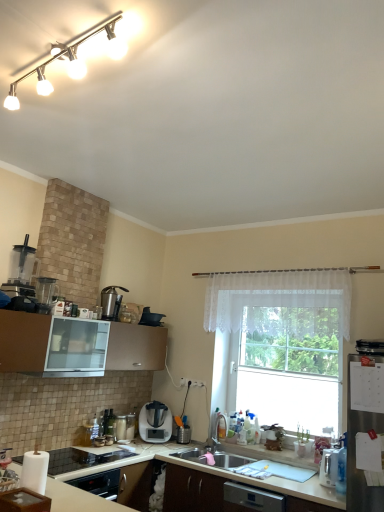
Image resolution: width=384 pixels, height=512 pixels. What do you see at coordinates (122, 426) in the screenshot?
I see `white glossy blender at lower center, marked as the third appliance in a left-to-right arrangement` at bounding box center [122, 426].

Describe the element at coordinates (333, 466) in the screenshot. I see `satin silver kettle at lower right, the 5th appliance in the back-to-front sequence` at that location.

Describe the element at coordinates (20, 273) in the screenshot. Image resolution: width=384 pixels, height=512 pixels. I see `transparent plastic blender at upper left, positioned as the second home appliance in back-to-front order` at that location.

Measure the distance between transparent plastic blender at upper left, the 1th home appliance from the top, and camera.

They are 9.76 feet apart.

Locate an element on the screen. The image size is (384, 512). metallic silver blender at left, placed as the 2th appliance when sorted from front to back is located at coordinates (45, 289).

Describe the element at coordinates (111, 302) in the screenshot. Image resolution: width=384 pixels, height=512 pixels. I see `metallic silver coffee maker at upper center` at that location.

In order to face matte black pot at upper center, marked as the 4th appliance in a bottom-to-top arrangement, should I rotate leftwards or rightwards?

A 5.035 degree turn to the left will do.

The width and height of the screenshot is (384, 512). I want to click on white glossy blender at lower center, placed as the fourth appliance when sorted from front to back, so click(x=122, y=426).

What's the angular difference between satin silver kettle at lower right, the 5th appliance in the back-to-front sequence, and white plastic electric outlet at center's facing directions?

satin silver kettle at lower right, the 5th appliance in the back-to-front sequence, and white plastic electric outlet at center are facing 177 degrees away from each other.

Would you say satin silver kettle at lower right, the 5th appliance in the back-to-front sequence, is inside or outside white plastic electric outlet at center?

satin silver kettle at lower right, the 5th appliance in the back-to-front sequence, is spatially situated outside white plastic electric outlet at center.

From the image's perspective, which is above, satin silver kettle at lower right, arranged as the 1th appliance when viewed from the front, or white plastic electric outlet at center?

From the image's view, white plastic electric outlet at center is above.

From the image's perspective, which one is positioned lower, white plastic electric outlet at center or metallic silver toaster at lower left, which is the third appliance in back-to-front order?

metallic silver toaster at lower left, which is the third appliance in back-to-front order, appears lower in the image.

Looking at this image, is white plastic electric outlet at center positioned with its back to metallic silver toaster at lower left, positioned as the 2th appliance in left-to-right order?

No, white plastic electric outlet at center is not facing the opposite direction of metallic silver toaster at lower left, positioned as the 2th appliance in left-to-right order.

From a real-world perspective, is white plastic electric outlet at center under metallic silver toaster at lower left, arranged as the fourth appliance when viewed from the right?

No.

Is white plastic electric outlet at center thinner than metallic silver toaster at lower left, arranged as the fourth appliance when viewed from the right?

Yes, white plastic electric outlet at center is thinner than metallic silver toaster at lower left, arranged as the fourth appliance when viewed from the right.

From a real-world perspective, between white sheer curtain at center and transparent plastic blender at upper left, which is the first home appliance from front to back, who is vertically higher?

From a 3D spatial view, white sheer curtain at center is above.

Is point (301, 287) farther from viewer compared to point (6, 287)?

Yes.

Would you say white sheer curtain at center is inside or outside transparent plastic blender at upper left, the 1th home appliance from the top?

white sheer curtain at center exists outside the volume of transparent plastic blender at upper left, the 1th home appliance from the top.

Is white sheer curtain at center far away from transparent plastic blender at upper left, positioned as the second home appliance in back-to-front order?

white sheer curtain at center is far away from transparent plastic blender at upper left, positioned as the second home appliance in back-to-front order.

Does white glossy track lights at upper left have a lesser width compared to white matte countertop at lower center, placed as the second countertop when sorted from top to bottom?

Indeed, white glossy track lights at upper left has a lesser width compared to white matte countertop at lower center, placed as the second countertop when sorted from top to bottom.

From a real-world perspective, is white glossy track lights at upper left physically below white matte countertop at lower center, placed as the second countertop when sorted from top to bottom?

No, from a real-world perspective, white glossy track lights at upper left is not under white matte countertop at lower center, placed as the second countertop when sorted from top to bottom.

From the image's perspective, which one is positioned lower, white glossy track lights at upper left or white matte countertop at lower center, placed as the second countertop when sorted from top to bottom?

From the image's view, white matte countertop at lower center, placed as the second countertop when sorted from top to bottom, is below.

Is white glossy track lights at upper left facing towards white matte countertop at lower center, placed as the second countertop when sorted from top to bottom?

No, white glossy track lights at upper left does not turn towards white matte countertop at lower center, placed as the second countertop when sorted from top to bottom.

Is point (119, 415) in front of point (42, 287)?

No, it is behind (42, 287).

Does white glossy blender at lower center, which appears as the fifth appliance when viewed from the top, have a greater height compared to metallic silver blender at left, which is counted as the first appliance, starting from the left?

In fact, white glossy blender at lower center, which appears as the fifth appliance when viewed from the top, may be shorter than metallic silver blender at left, which is counted as the first appliance, starting from the left.

Considering the sizes of objects white glossy blender at lower center, marked as the third appliance in a left-to-right arrangement, and metallic silver blender at left, arranged as the fifth appliance when viewed from the right, in the image provided, who is wider, white glossy blender at lower center, marked as the third appliance in a left-to-right arrangement, or metallic silver blender at left, arranged as the fifth appliance when viewed from the right,?

Wider between the two is white glossy blender at lower center, marked as the third appliance in a left-to-right arrangement.

How many degrees apart are the facing directions of white glossy blender at lower center, which appears as the 2th appliance when viewed from the back, and metallic silver blender at left, placed as the 2th appliance when sorted from front to back?

The angle between the facing direction of white glossy blender at lower center, which appears as the 2th appliance when viewed from the back, and the facing direction of metallic silver blender at left, placed as the 2th appliance when sorted from front to back, is 5.89 degrees.

Does white plastic electric outlet at center have a greater width compared to matte black pot at upper center, marked as the fifth appliance in a front-to-back arrangement?

No, white plastic electric outlet at center is not wider than matte black pot at upper center, marked as the fifth appliance in a front-to-back arrangement.

From the image's perspective, between white plastic electric outlet at center and matte black pot at upper center, positioned as the second appliance in right-to-left order, which one is located above?

From the image's view, matte black pot at upper center, positioned as the second appliance in right-to-left order, is above.

The height and width of the screenshot is (512, 384). I want to click on appliance that is the 1st one above the white plastic electric outlet at center (from a real-world perspective), so click(150, 318).

Is there a large distance between white plastic electric outlet at center and matte black pot at upper center, acting as the second appliance starting from the top?

They are positioned close to each other.

Does satin silver blender at center, which ranks as the second home appliance in front-to-back order, have a greater width compared to white plastic electric outlet at center?

Yes, satin silver blender at center, which ranks as the second home appliance in front-to-back order, is wider than white plastic electric outlet at center.

Who is smaller, satin silver blender at center, marked as the first home appliance in a back-to-front arrangement, or white plastic electric outlet at center?

Smaller between the two is white plastic electric outlet at center.

Is satin silver blender at center, marked as the first home appliance in a back-to-front arrangement, not inside white plastic electric outlet at center?

Absolutely, satin silver blender at center, marked as the first home appliance in a back-to-front arrangement, is external to white plastic electric outlet at center.

Consider the image. Which point is more forward, (145, 435) or (195, 383)?

Positioned in front is point (145, 435).

This screenshot has height=512, width=384. Identify the location of the 1st appliance positioned below the white plastic electric outlet at center (from a real-world perspective). (333, 466).

From the image's perspective, count 2nd appliances downward from the white plastic electric outlet at center and point to it. Please provide its 2D coordinates.

[(90, 431)]

Looking at the image, which one is located further to white matte countertop at lower center, placed as the second countertop when sorted from top to bottom, transparent plastic blender at upper left, positioned as the second home appliance in back-to-front order, or white glossy track lights at upper left?

white glossy track lights at upper left.

From the image, which object appears to be farther from metallic silver blender at left, which is counted as the first appliance, starting from the left, white glossy countertop at lower left, the first countertop viewed from the top, or metallic silver toaster at lower left, which is counted as the second appliance, starting from the bottom?

white glossy countertop at lower left, the first countertop viewed from the top, is further to metallic silver blender at left, which is counted as the first appliance, starting from the left.

From the image, which object appears to be nearer to metallic silver coffee maker at upper center, transparent plastic blender at upper left, the 1th home appliance from the top, or white matte countertop at lower center, the first countertop positioned from the bottom?

Among the two, transparent plastic blender at upper left, the 1th home appliance from the top, is located nearer to metallic silver coffee maker at upper center.

Looking at the image, which one is located closer to clear glass window at center, transparent plastic blender at upper left, positioned as the second home appliance in back-to-front order, or white sheer curtain at center?

white sheer curtain at center.

Looking at the image, which one is located closer to clear glass window at center, white plastic electric outlet at center or matte black pot at upper center, acting as the second appliance starting from the top?

white plastic electric outlet at center lies closer to clear glass window at center than the other object.

Looking at the image, which one is located further to white glossy blender at lower center, placed as the fourth appliance when sorted from front to back, matte black pot at upper center, marked as the 4th appliance in a bottom-to-top arrangement, or metallic silver coffee maker at upper center?

The object further to white glossy blender at lower center, placed as the fourth appliance when sorted from front to back, is metallic silver coffee maker at upper center.

Which object lies further to the anchor point transparent plastic blender at upper left, marked as the 2th home appliance in a right-to-left arrangement, white sheer curtain at center or metallic silver coffee maker at upper center?

white sheer curtain at center.

Considering their positions, is satin silver blender at center, which appears as the 1th home appliance when ordered from the bottom, positioned closer to metallic silver coffee maker at upper center than white plastic electric outlet at center?

satin silver blender at center, which appears as the 1th home appliance when ordered from the bottom, is closer to metallic silver coffee maker at upper center.

Locate an element on the screen. appliance situated between white glossy blender at lower center, marked as the third appliance in a left-to-right arrangement, and clear glass window at center from left to right is located at coordinates (150, 318).

Identify the location of countertop positioned between brown matte cabinet at lower left and white glossy blender at lower center, placed as the fourth appliance when sorted from front to back, from near to far. The image size is (384, 512). 78,499.

Image resolution: width=384 pixels, height=512 pixels. Find the location of `window located between brown matte cabinet at lower left and satin silver kettle at lower right, the 5th appliance in the back-to-front sequence, in the left-right direction`. window located between brown matte cabinet at lower left and satin silver kettle at lower right, the 5th appliance in the back-to-front sequence, in the left-right direction is located at coordinates (284, 343).

Locate an element on the screen. home appliance that lies between metallic silver coffee maker at upper center and white glossy countertop at lower left, which appears as the 2th countertop when ordered from the bottom, from top to bottom is located at coordinates (155, 424).